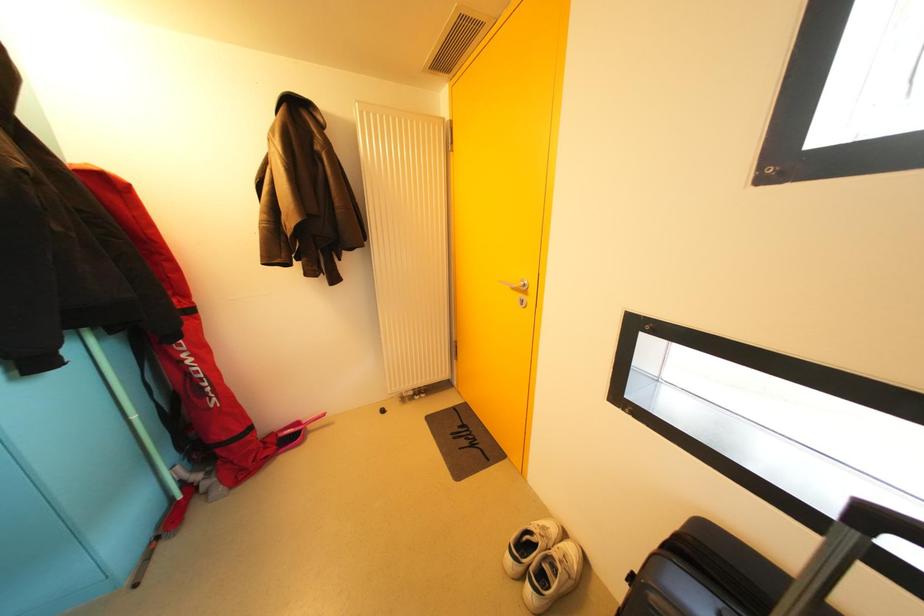
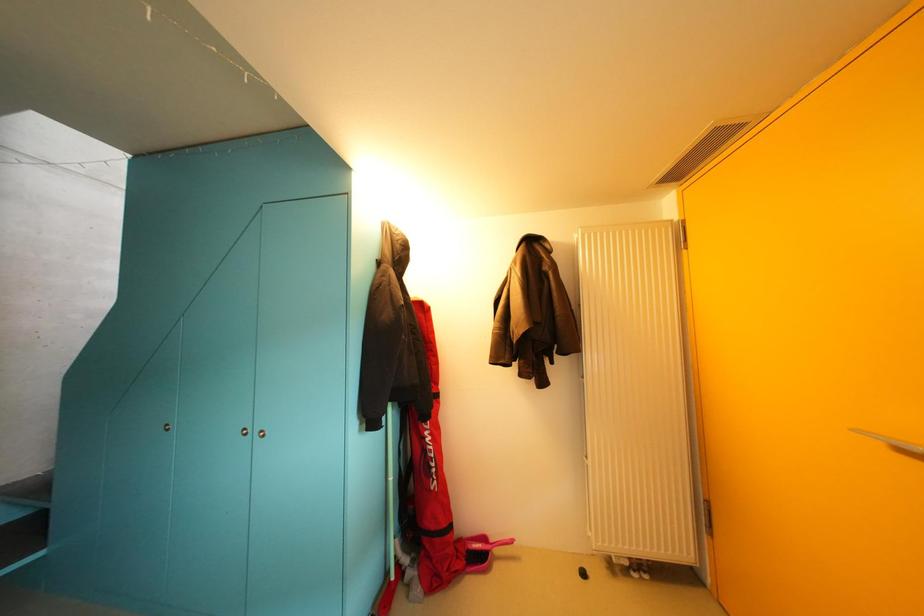
The images are taken continuously from a first-person perspective. In which direction is your viewpoint rotating?

The camera rotated toward left-up.